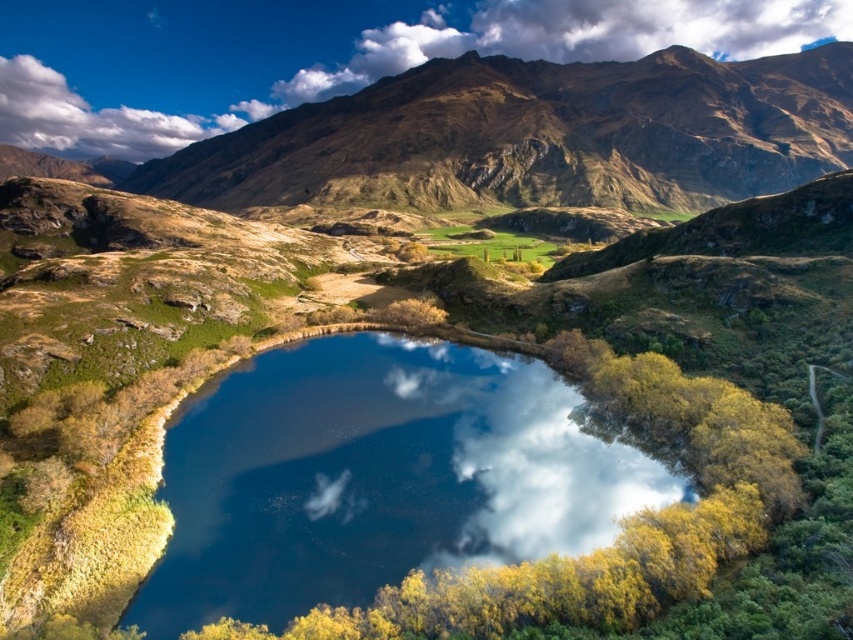
You are standing on the lakeshore and want to take a photo of the white fluffy cloud at upper center and the glossy blue water at center. Which object will appear higher in your photo?

The white fluffy cloud at upper center will appear higher in the photo because it is positioned above the glossy blue water at center.

Please provide the coordinates of the white fluffy cloud at upper center in the image. The coordinate system has the origin at the bottom left corner of the image, with the x and y axes increasing to the right and up respectively.

The white fluffy cloud at upper center is located at coordinates point (343,60).